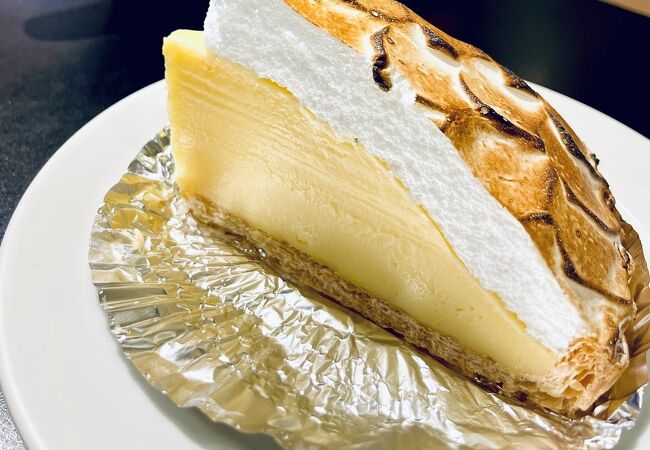
Locate an element on the screen. The image size is (650, 450). plate is located at coordinates (44, 350).